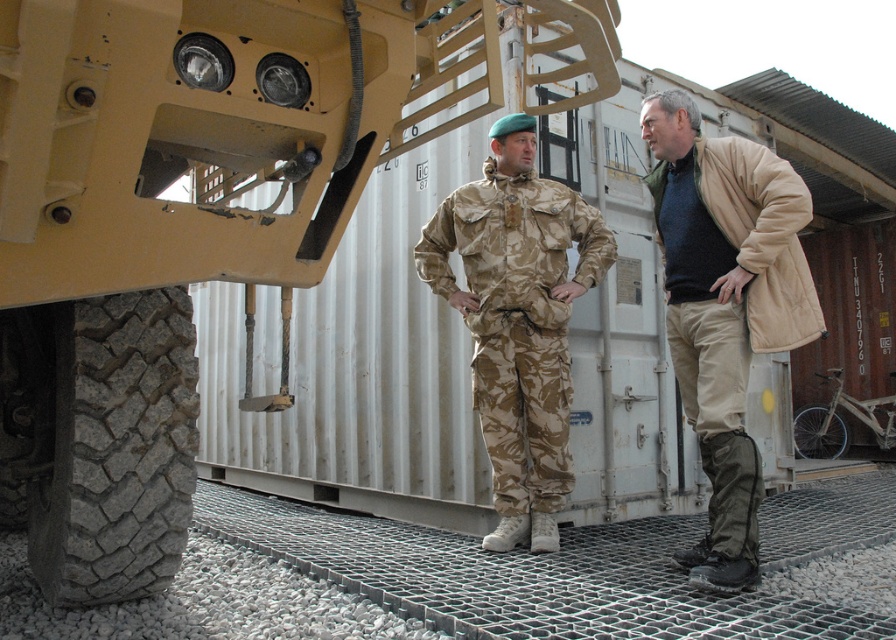
Question: Does beige fleece jacket at right come in front of white matte bicycle at lower right?

Choices:
 (A) yes
 (B) no

Answer: (A)

Question: Which of the following is the closest to the observer?

Choices:
 (A) camouflage fabric uniform at center
 (B) white matte bicycle at lower right
 (C) beige fleece jacket at right

Answer: (C)

Question: Can you confirm if camouflage fabric uniform at center is positioned to the left of white matte bicycle at lower right?

Choices:
 (A) yes
 (B) no

Answer: (A)

Question: Which of the following is the farthest from the observer?

Choices:
 (A) (754, 508)
 (B) (494, 314)
 (C) (812, 440)

Answer: (C)

Question: Does camouflage fabric uniform at center appear over white matte bicycle at lower right?

Choices:
 (A) yes
 (B) no

Answer: (A)

Question: Among these objects, which one is farthest from the camera?

Choices:
 (A) beige fleece jacket at right
 (B) white matte bicycle at lower right
 (C) camouflage fabric uniform at center

Answer: (B)